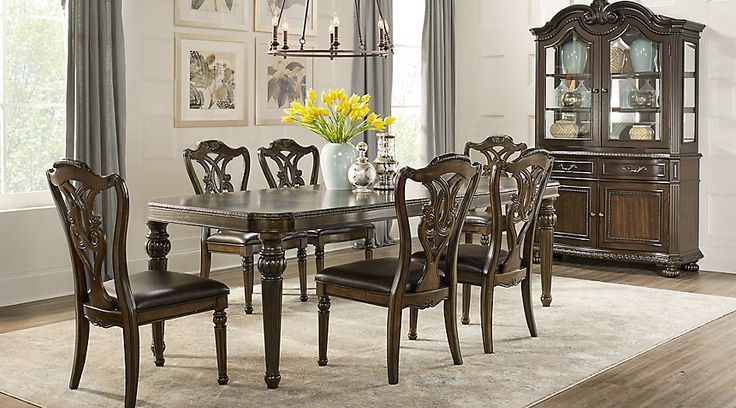
Find the location of a particular element. chairs is located at coordinates (91, 185), (218, 149), (285, 145), (439, 166), (514, 161), (492, 142).